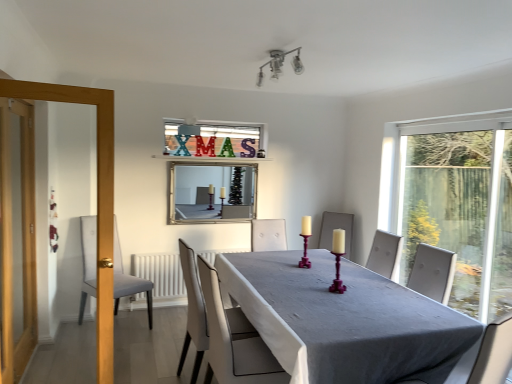
Identify the location of free point above silver/glass mirror at upper center (from a real-world perspective). (212, 160).